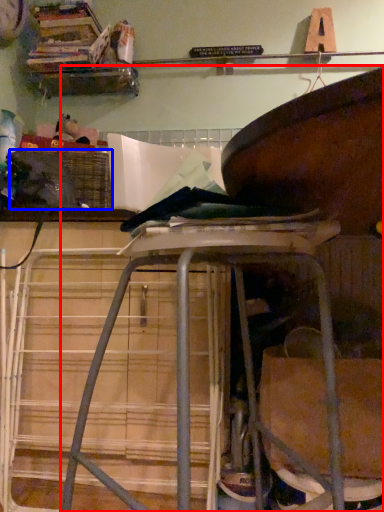
Question: Among these objects, which one is nearest to the camera, furniture (highlighted by a red box) or crate (highlighted by a blue box)?

Choices:
 (A) furniture
 (B) crate

Answer: (A)